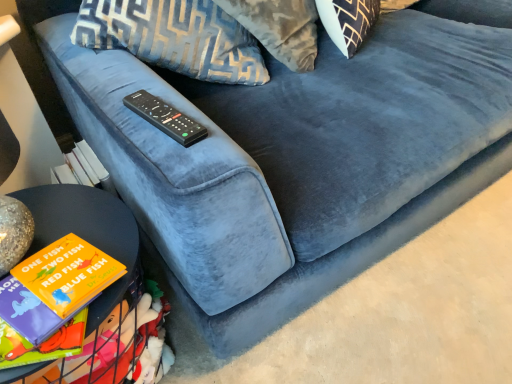
Question: Considering the relative sizes of matte black table at lower left and black plastic remote at center in the image provided, is matte black table at lower left bigger than black plastic remote at center?

Choices:
 (A) yes
 (B) no

Answer: (A)

Question: From the image's perspective, is matte black table at lower left below black plastic remote at center?

Choices:
 (A) yes
 (B) no

Answer: (A)

Question: Is matte black table at lower left facing away from black plastic remote at center?

Choices:
 (A) no
 (B) yes

Answer: (A)

Question: Can you confirm if matte black table at lower left is positioned to the right of black plastic remote at center?

Choices:
 (A) no
 (B) yes

Answer: (A)

Question: Is matte black table at lower left thinner than black plastic remote at center?

Choices:
 (A) yes
 (B) no

Answer: (B)

Question: Does matte black table at lower left have a greater width compared to black plastic remote at center?

Choices:
 (A) no
 (B) yes

Answer: (B)

Question: Does black plastic remote at center have a lesser height compared to matte black table at lower left?

Choices:
 (A) no
 (B) yes

Answer: (B)

Question: Considering the relative sizes of black plastic remote at center and matte black table at lower left in the image provided, is black plastic remote at center bigger than matte black table at lower left?

Choices:
 (A) yes
 (B) no

Answer: (B)

Question: From a real-world perspective, is black plastic remote at center on matte black table at lower left?

Choices:
 (A) yes
 (B) no

Answer: (A)

Question: Does black plastic remote at center touch matte black table at lower left?

Choices:
 (A) no
 (B) yes

Answer: (A)

Question: From the image's perspective, does black plastic remote at center appear lower than matte black table at lower left?

Choices:
 (A) no
 (B) yes

Answer: (A)

Question: Considering the relative sizes of black plastic remote at center and matte black table at lower left in the image provided, is black plastic remote at center thinner than matte black table at lower left?

Choices:
 (A) no
 (B) yes

Answer: (B)

Question: In terms of width, does black plastic remote at center look wider or thinner when compared to matte black table at lower left?

Choices:
 (A) wide
 (B) thin

Answer: (B)